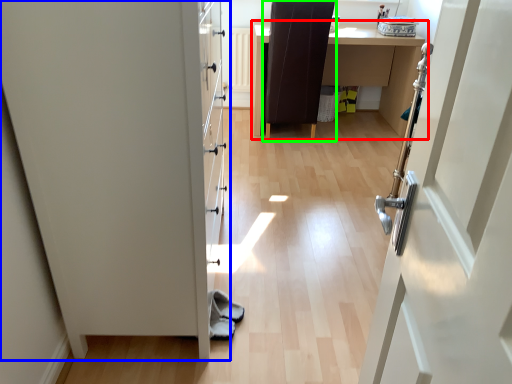
Question: Which is farther away from table (highlighted by a red box)? door (highlighted by a blue box) or chair (highlighted by a green box)?

Choices:
 (A) door
 (B) chair

Answer: (A)